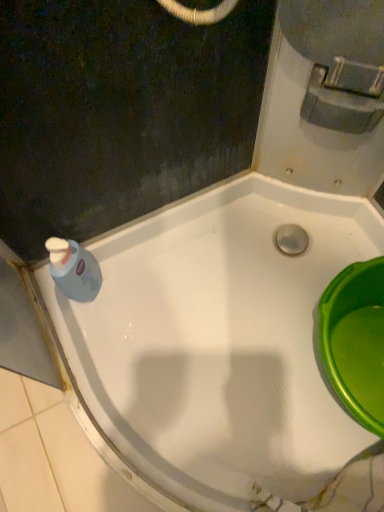
Locate an element on the screen. This screenshot has height=512, width=384. white glossy bathtub at center is located at coordinates (223, 351).

The width and height of the screenshot is (384, 512). What do you see at coordinates (223, 351) in the screenshot? I see `white glossy bathtub at center` at bounding box center [223, 351].

What is the approximate width of white glossy bathtub at center?

white glossy bathtub at center is 34.00 inches wide.

Where is `white glossy bathtub at center`? white glossy bathtub at center is located at coordinates (223, 351).